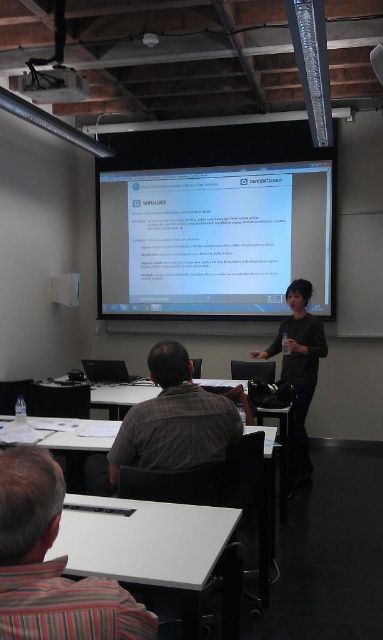
You are standing in the classroom facing the front. There is a point marked at coordinates (x=214, y=240). What object in the scene is located at that point?

The white glossy projector screen at upper center is located at point (x=214, y=240).

What is located at the point with coordinates (52, 564) in the image?

The striped fabric shirt at lower left is located at point (52, 564).

You are a photographer in the classroom and want to take a picture of the striped fabric shirt at lower left and the plaid fabric shirt at center. Which shirt will appear smaller in the photo?

The striped fabric shirt at lower left will appear smaller in the photo because it has a lesser height compared to the plaid fabric shirt at center.